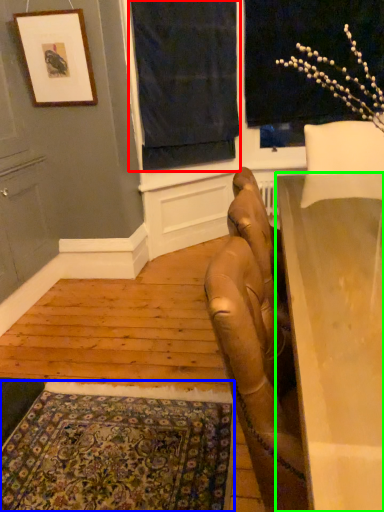
Question: Which object is the closest to the curtain (highlighted by a red box)? Choose among these: mat (highlighted by a blue box) or table (highlighted by a green box).

Choices:
 (A) mat
 (B) table

Answer: (B)